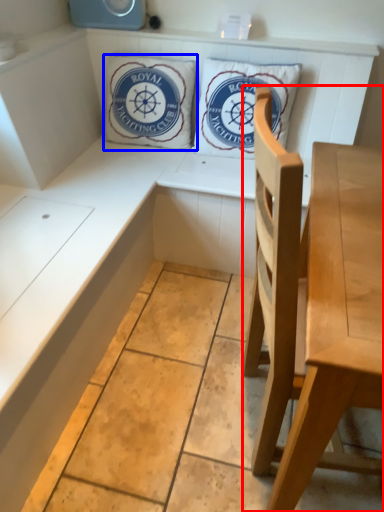
Question: Which point is closer to the camera, chair (highlighted by a red box) or pillow (highlighted by a blue box)?

Choices:
 (A) chair
 (B) pillow

Answer: (A)